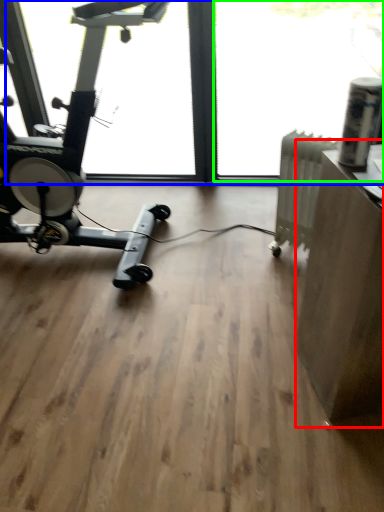
Question: Considering the real-world distances, which object is farthest from computer desk (highlighted by a red box)? window screen (highlighted by a blue box) or window screen (highlighted by a green box)?

Choices:
 (A) window screen
 (B) window screen

Answer: (B)